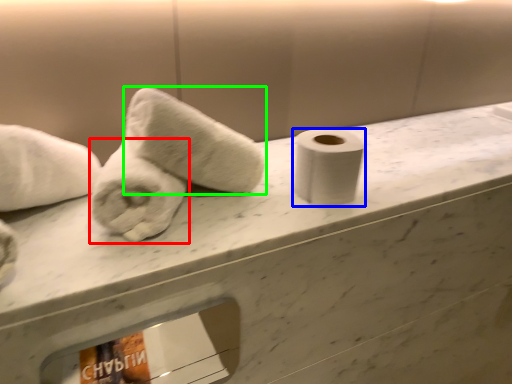
Question: Which is nearer to the towel (highlighted by a red box)? toilet paper (highlighted by a blue box) or towel (highlighted by a green box).

Choices:
 (A) toilet paper
 (B) towel

Answer: (B)